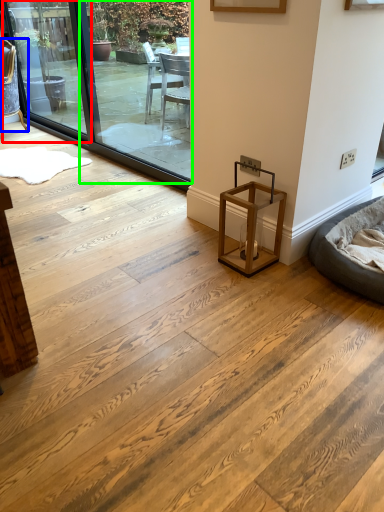
Question: Estimate the real-world distances between objects in this image. Which object is farther from window screen (highlighted by a red box), chair (highlighted by a blue box) or window screen (highlighted by a green box)?

Choices:
 (A) chair
 (B) window screen

Answer: (B)